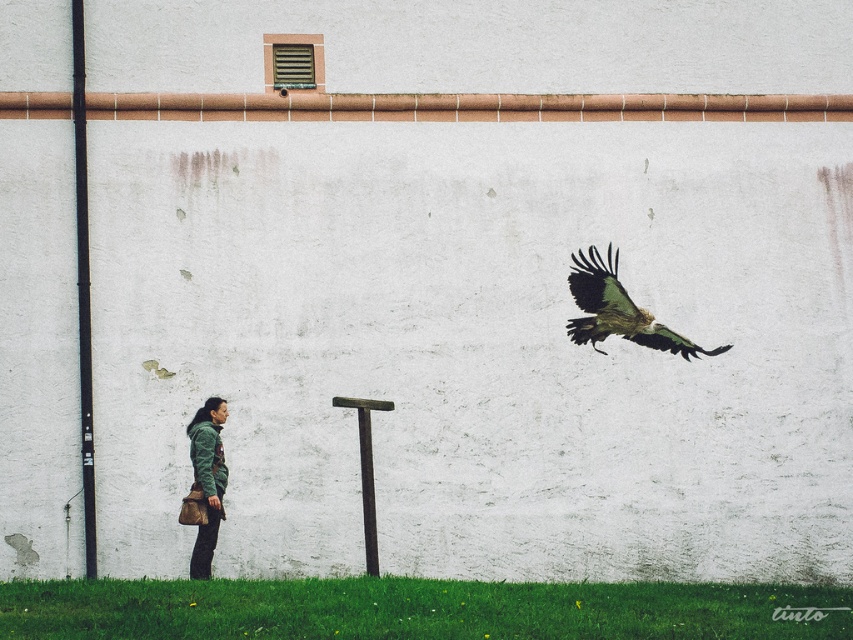
The height and width of the screenshot is (640, 853). Describe the element at coordinates (83, 285) in the screenshot. I see `black matte pole at left` at that location.

Does black matte pole at left appear under greenish-brown textured eagle at upper right?

No, black matte pole at left is not below greenish-brown textured eagle at upper right.

Who is more distant from viewer, (85, 531) or (683, 337)?

The point (85, 531) is more distant.

Where is `black matte pole at left`? The width and height of the screenshot is (853, 640). black matte pole at left is located at coordinates coord(83,285).

Looking at this image, can you confirm if black matte pole at left is positioned above green matte jacket at lower left?

Correct, black matte pole at left is located above green matte jacket at lower left.

Does point (77, 67) lie behind point (206, 444)?

Yes, point (77, 67) is behind point (206, 444).

The image size is (853, 640). In order to click on black matte pole at left in this screenshot , I will do `click(83, 285)`.

Based on the photo, who is more distant from viewer, (621, 310) or (210, 492)?

The point (210, 492) is behind.

Which of these two, greenish-brown textured eagle at upper right or green matte jacket at lower left, stands taller?

Standing taller between the two is green matte jacket at lower left.

Does point (587, 339) lie in front of point (221, 397)?

Yes, point (587, 339) is in front of point (221, 397).

Locate an element on the screen. greenish-brown textured eagle at upper right is located at coordinates (618, 310).